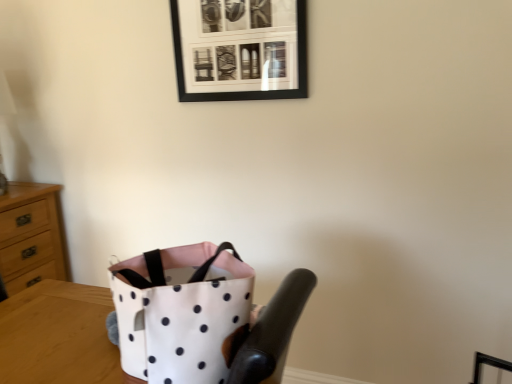
Question: Do you think white fabric bag at center is within black matte picture frame at upper center, or outside of it?

Choices:
 (A) outside
 (B) inside

Answer: (A)

Question: Considering the positions of white fabric bag at center and black matte picture frame at upper center in the image, is white fabric bag at center taller or shorter than black matte picture frame at upper center?

Choices:
 (A) short
 (B) tall

Answer: (B)

Question: Which is nearer to the white fabric bag at center?

Choices:
 (A) black matte picture frame at upper center
 (B) wooden chest of drawers at left
 (C) white polka dot fabric bag at lower center

Answer: (C)

Question: Which object is the farthest from the black matte picture frame at upper center?

Choices:
 (A) wooden chest of drawers at left
 (B) white polka dot fabric bag at lower center
 (C) white fabric bag at center

Answer: (A)